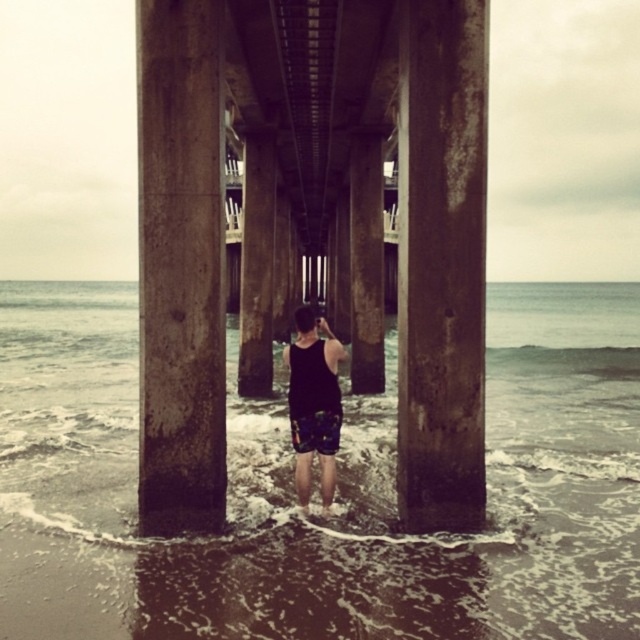
How far apart are concrete textured pillar at center and rusty metal pillar at center?

concrete textured pillar at center and rusty metal pillar at center are 8.59 feet apart from each other.

Does concrete textured pillar at center have a smaller size compared to rusty metal pillar at center?

No, concrete textured pillar at center is not smaller than rusty metal pillar at center.

Between point (456, 38) and point (449, 435), which one is positioned behind?

Point (449, 435)

You are a GUI agent. You are given a task and a screenshot of the screen. Output one action in this format:
    pyautogui.click(x=<x>, y=<y>)
    Task: Click on the concrete textured pillar at center
    
    Given the screenshot: What is the action you would take?
    pyautogui.click(x=426, y=228)

Is sandy water at lower center smaller than dark gray concrete pillar at center?

Incorrect, sandy water at lower center is not smaller in size than dark gray concrete pillar at center.

Does sandy water at lower center come behind dark gray concrete pillar at center?

That is False.

Between point (346, 556) and point (200, 60), which one is positioned behind?

Point (200, 60)

This screenshot has width=640, height=640. I want to click on sandy water at lower center, so click(x=339, y=483).

Is sandy water at lower center above concrete textured pillar at center?

Incorrect, sandy water at lower center is not positioned above concrete textured pillar at center.

How distant is sandy water at lower center from concrete textured pillar at center?

sandy water at lower center is 31.13 feet from concrete textured pillar at center.

What do you see at coordinates (339, 483) in the screenshot? I see `sandy water at lower center` at bounding box center [339, 483].

The image size is (640, 640). What are the coordinates of `sandy water at lower center` in the screenshot? It's located at (339, 483).